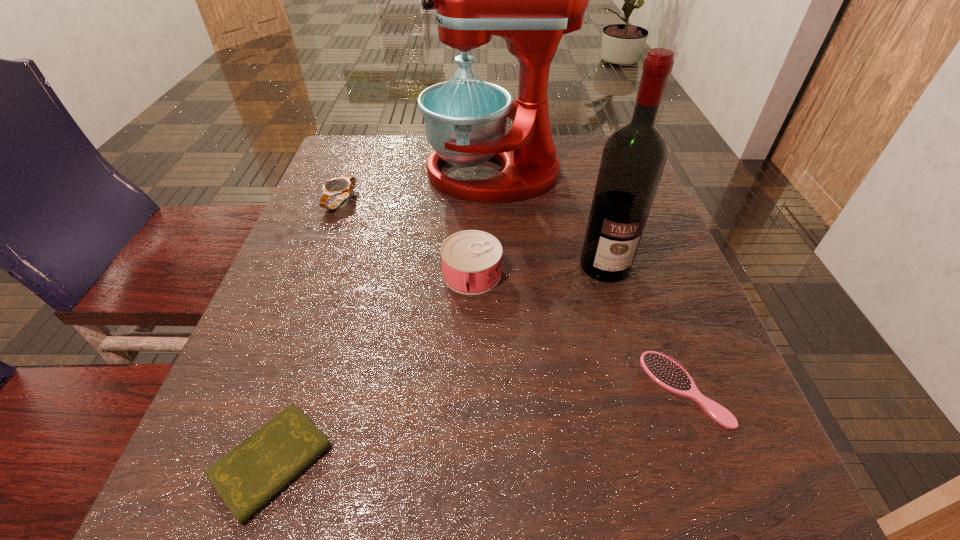
Find the location of a particular element. This screenshot has width=960, height=540. object present at the near left corner is located at coordinates (250, 475).

Identify the location of vacant space at the far edge. The image size is (960, 540). (417, 165).

I want to click on vacant region at the near edge, so click(x=602, y=519).

Locate an element on the screen. The width and height of the screenshot is (960, 540). vacant space at the left edge of the desktop is located at coordinates (348, 213).

In the image, there is a desktop. Where is `blank space at the right edge`? The image size is (960, 540). blank space at the right edge is located at coordinates (611, 294).

In the image, there is a desktop. Identify the location of free space at the far left corner. This screenshot has width=960, height=540. (328, 167).

This screenshot has width=960, height=540. Identify the location of free space at the near left corner of the desktop. (195, 522).

Locate an element on the screen. This screenshot has height=540, width=960. free spot at the far right corner of the desktop is located at coordinates (579, 153).

Where is `vacant point located between the third tallest object and the shortest object`? The image size is (960, 540). vacant point located between the third tallest object and the shortest object is located at coordinates (372, 368).

The height and width of the screenshot is (540, 960). I want to click on vacant area between the watch and the diary, so click(306, 331).